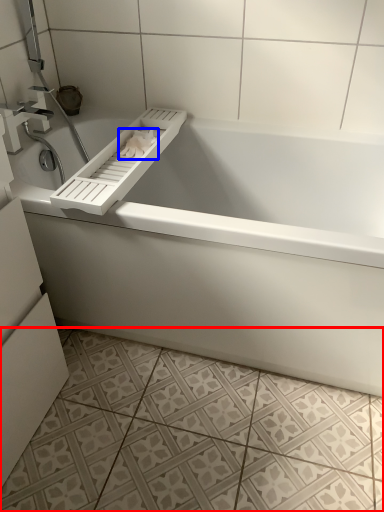
Question: Among these objects, which one is nearest to the camera, ceramic tile (highlighted by a red box) or toilet paper (highlighted by a blue box)?

Choices:
 (A) ceramic tile
 (B) toilet paper

Answer: (A)